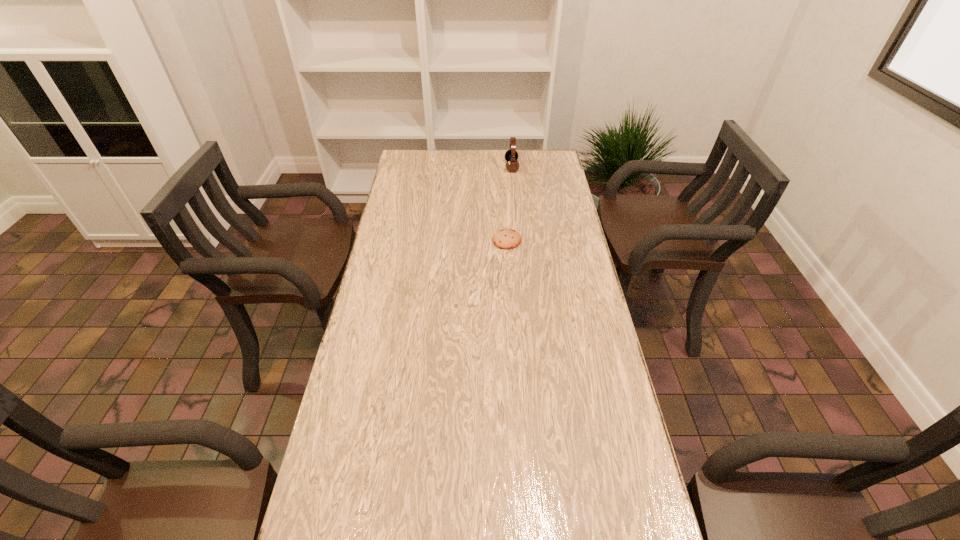
Where is `free location at the left edge of the desktop`? free location at the left edge of the desktop is located at coordinates (395, 209).

The width and height of the screenshot is (960, 540). In the image, there is a desktop. What are the coordinates of `vacant space at the right edge` in the screenshot? It's located at (548, 207).

In the image, there is a desktop. At what (x,y) coordinates should I click in order to perform the action: click on free space at the far left corner. Please return your answer as a coordinate pair (x, y). Looking at the image, I should click on (410, 164).

Locate an element on the screen. The height and width of the screenshot is (540, 960). unoccupied area between the taller object and the nearer object is located at coordinates (510, 204).

What are the coordinates of `blank region between the farther object and the shorter object` in the screenshot? It's located at (510, 204).

I want to click on free point between the cookie and the farther object, so click(x=510, y=204).

The height and width of the screenshot is (540, 960). I want to click on free space between the headset and the shorter object, so click(510, 204).